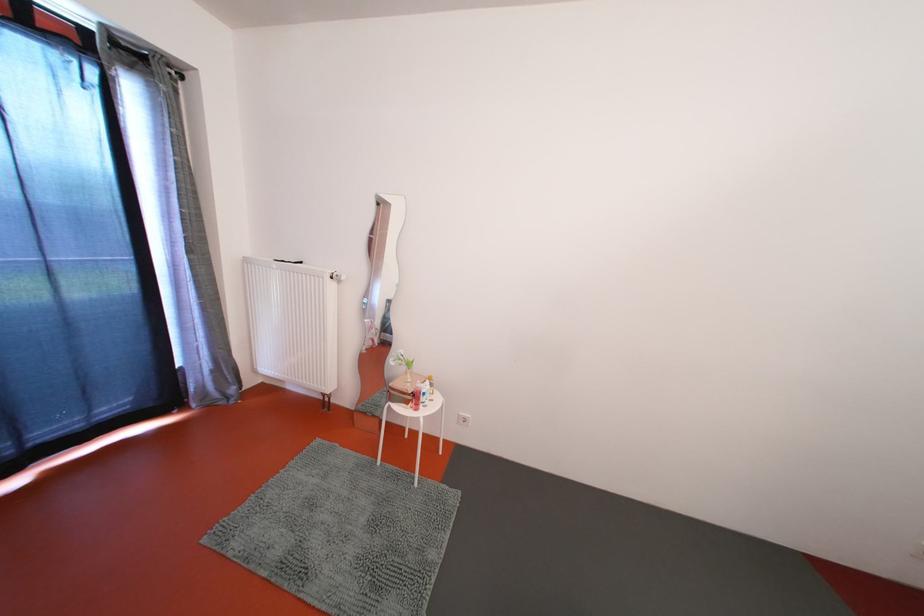
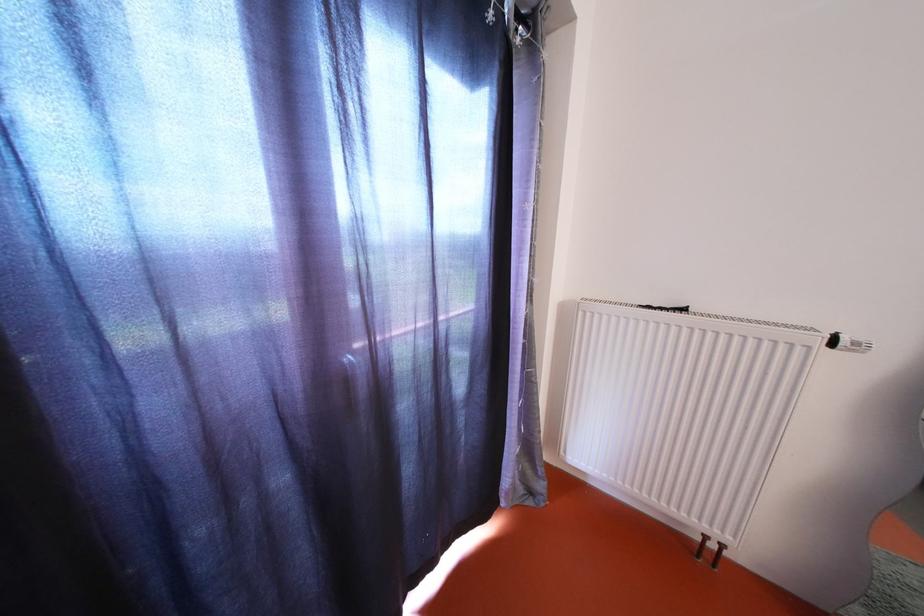
Where in the second image is the point corresponding to point (345, 282) from the first image?

(862, 349)